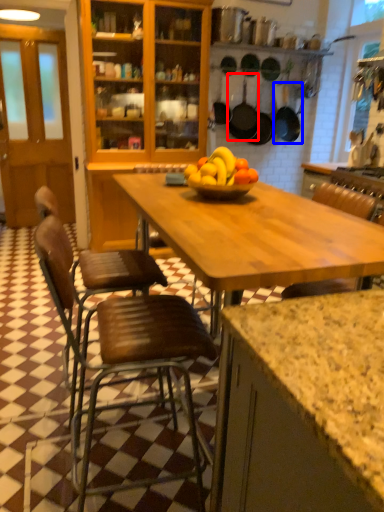
Question: Which of the following is the closest to the observer, frying pan (highlighted by a red box) or frying pan (highlighted by a blue box)?

Choices:
 (A) frying pan
 (B) frying pan

Answer: (A)